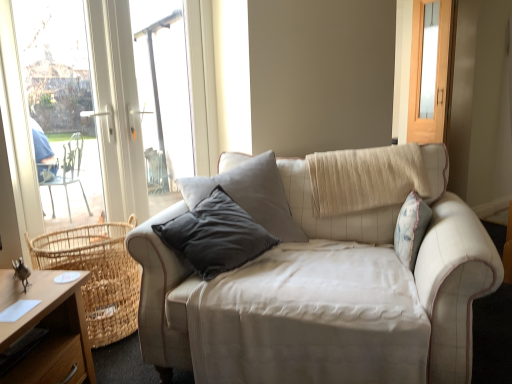
Question: Would you say matte wooden screen door at upper right is a long distance from woven natural basket at lower left?

Choices:
 (A) no
 (B) yes

Answer: (B)

Question: Is matte wooden screen door at upper right wider than woven natural basket at lower left?

Choices:
 (A) yes
 (B) no

Answer: (B)

Question: Is matte wooden screen door at upper right to the left of woven natural basket at lower left from the viewer's perspective?

Choices:
 (A) yes
 (B) no

Answer: (B)

Question: Is matte wooden screen door at upper right behind woven natural basket at lower left?

Choices:
 (A) yes
 (B) no

Answer: (A)

Question: Can you confirm if matte wooden screen door at upper right is thinner than woven natural basket at lower left?

Choices:
 (A) no
 (B) yes

Answer: (B)

Question: Is matte wooden screen door at upper right in front of or behind beige fabric couch at center in the image?

Choices:
 (A) behind
 (B) front

Answer: (A)

Question: Is matte wooden screen door at upper right to the left or to the right of beige fabric couch at center in the image?

Choices:
 (A) right
 (B) left

Answer: (A)

Question: From the image's perspective, is matte wooden screen door at upper right above or below beige fabric couch at center?

Choices:
 (A) below
 (B) above

Answer: (B)

Question: Do you think matte wooden screen door at upper right is within beige fabric couch at center, or outside of it?

Choices:
 (A) outside
 (B) inside

Answer: (A)

Question: From the image's perspective, relative to matte wooden screen door at upper right, is wooden desk at lower left above or below?

Choices:
 (A) below
 (B) above

Answer: (A)

Question: From their relative heights in the image, would you say wooden desk at lower left is taller or shorter than matte wooden screen door at upper right?

Choices:
 (A) tall
 (B) short

Answer: (B)

Question: Based on their sizes in the image, would you say wooden desk at lower left is bigger or smaller than matte wooden screen door at upper right?

Choices:
 (A) small
 (B) big

Answer: (B)

Question: Based on their positions, is wooden desk at lower left located to the left or right of matte wooden screen door at upper right?

Choices:
 (A) left
 (B) right

Answer: (A)

Question: Relative to wooden desk at lower left, is beige fabric couch at center in front or behind?

Choices:
 (A) front
 (B) behind

Answer: (A)

Question: In the image, is beige fabric couch at center on the left side or the right side of wooden desk at lower left?

Choices:
 (A) left
 (B) right

Answer: (B)